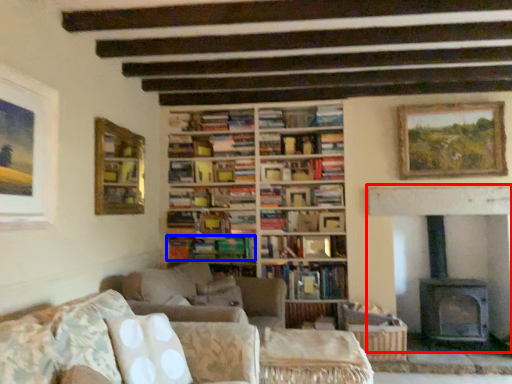
Question: Among these objects, which one is nearest to the camera, fireplace (highlighted by a red box) or book (highlighted by a blue box)?

Choices:
 (A) fireplace
 (B) book

Answer: (A)